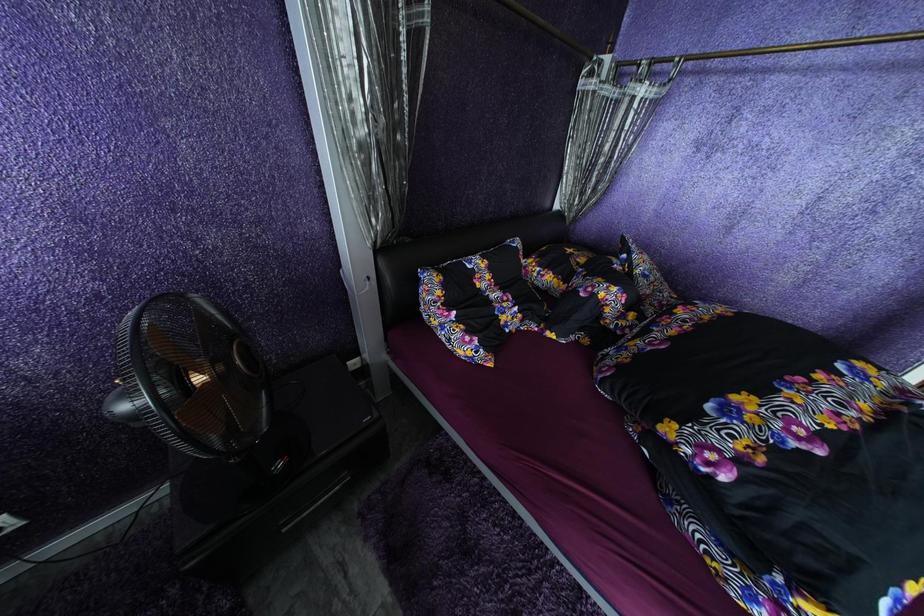
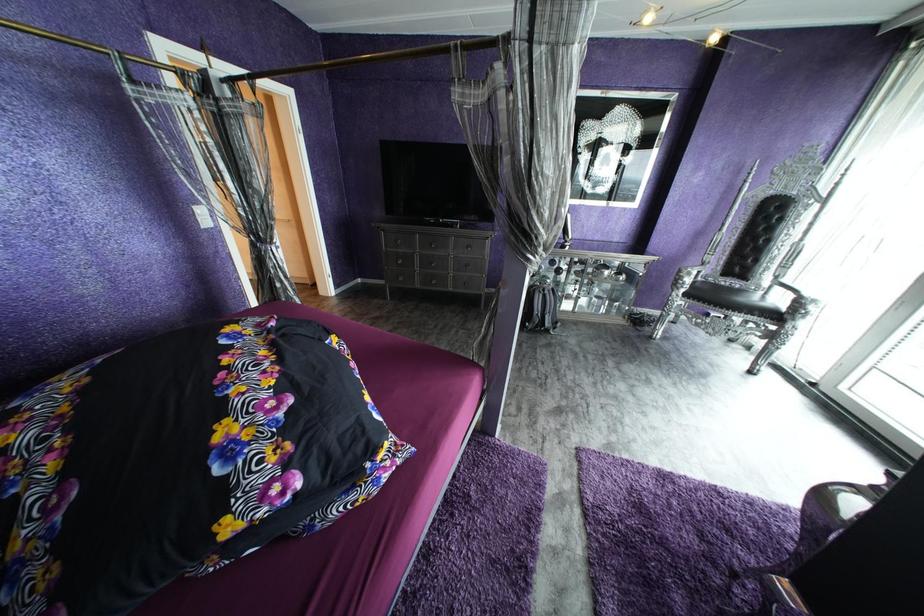
The images are taken continuously from a first-person perspective. In which direction is your viewpoint rotating?

The camera's rotation is toward right-down.